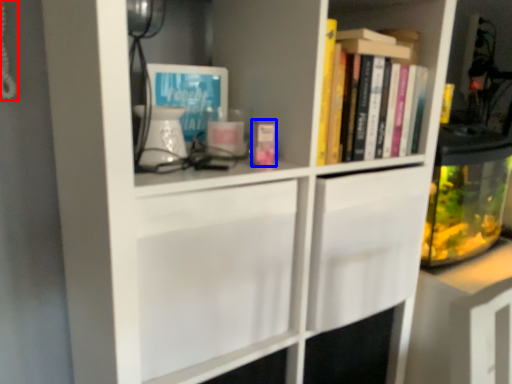
Question: Among these objects, which one is nearest to the camera, corded phone (highlighted by a red box) or book (highlighted by a blue box)?

Choices:
 (A) corded phone
 (B) book

Answer: (A)